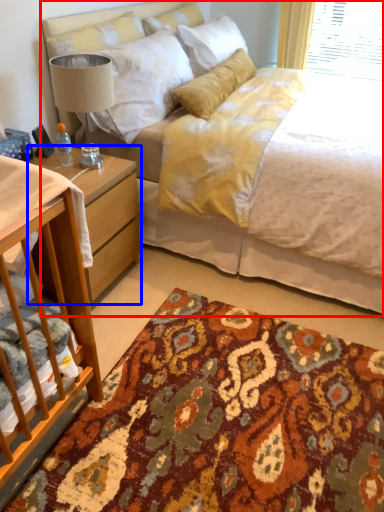
Question: Which object is closer to the camera taking this photo, bed (highlighted by a red box) or nightstand (highlighted by a blue box)?

Choices:
 (A) bed
 (B) nightstand

Answer: (A)